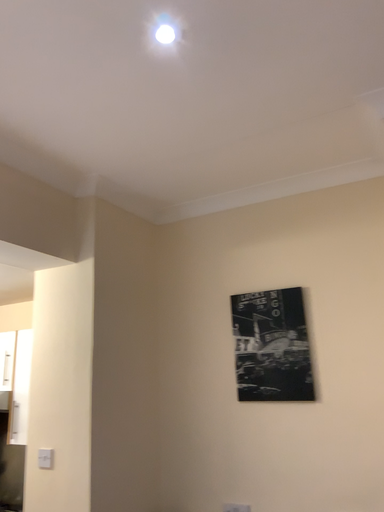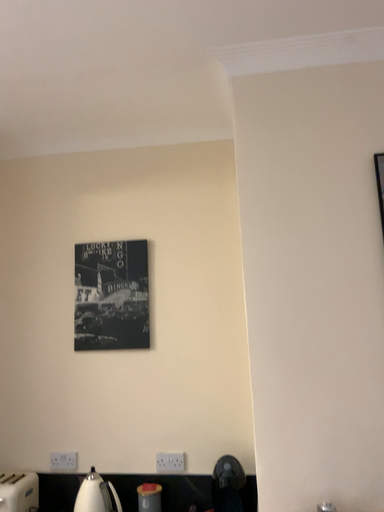
Question: How did the camera likely rotate when shooting the video?

Choices:
 (A) rotated left
 (B) rotated right

Answer: (B)